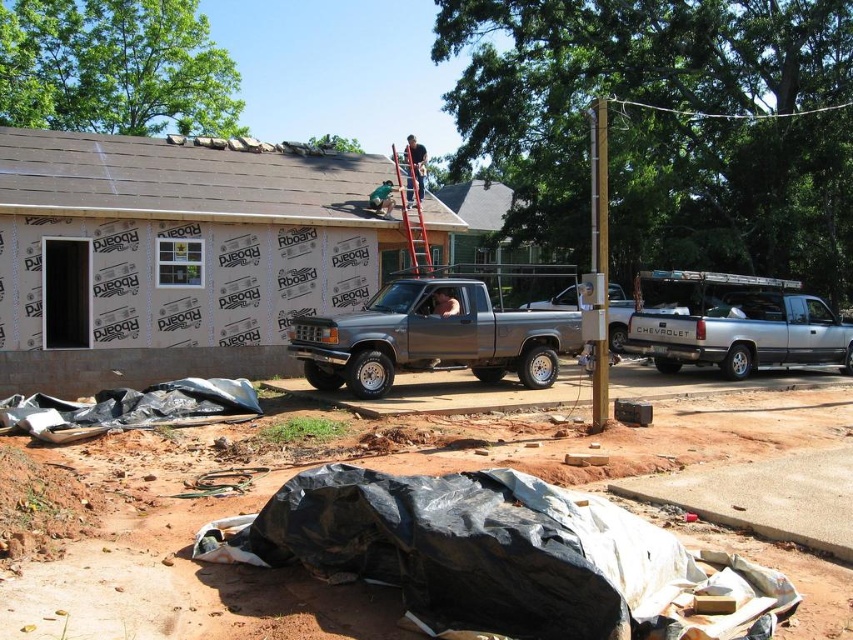
Is wooden ladder at center taller than matte black shirt at upper center?

Correct, wooden ladder at center is much taller as matte black shirt at upper center.

Can you confirm if wooden ladder at center is positioned to the right of matte black shirt at upper center?

In fact, wooden ladder at center is to the left of matte black shirt at upper center.

Identify the location of wooden ladder at center. (412, 205).

Does gray metallic truck at center come in front of matte black shirt at upper center?

Yes.

Is gray metallic truck at center behind matte black shirt at upper center?

No, gray metallic truck at center is closer to the viewer.

Which is in front, point (306, 368) or point (409, 198)?

Point (306, 368)

Image resolution: width=853 pixels, height=640 pixels. I want to click on gray metallic truck at center, so click(431, 337).

Is silver metallic truck at right closer to camera compared to matte black shirt at upper center?

Yes, silver metallic truck at right is in front of matte black shirt at upper center.

Can you confirm if silver metallic truck at right is smaller than matte black shirt at upper center?

Indeed, silver metallic truck at right has a smaller size compared to matte black shirt at upper center.

At what (x,y) coordinates should I click in order to perform the action: click on silver metallic truck at right. Please return your answer as a coordinate pair (x, y). Looking at the image, I should click on (735, 324).